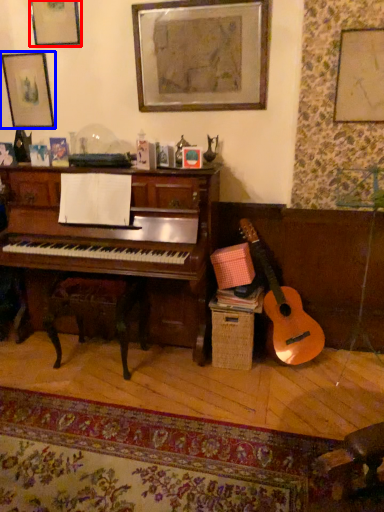
Question: Which object appears closest to the camera in this image, picture frame (highlighted by a red box) or picture frame (highlighted by a blue box)?

Choices:
 (A) picture frame
 (B) picture frame

Answer: (A)